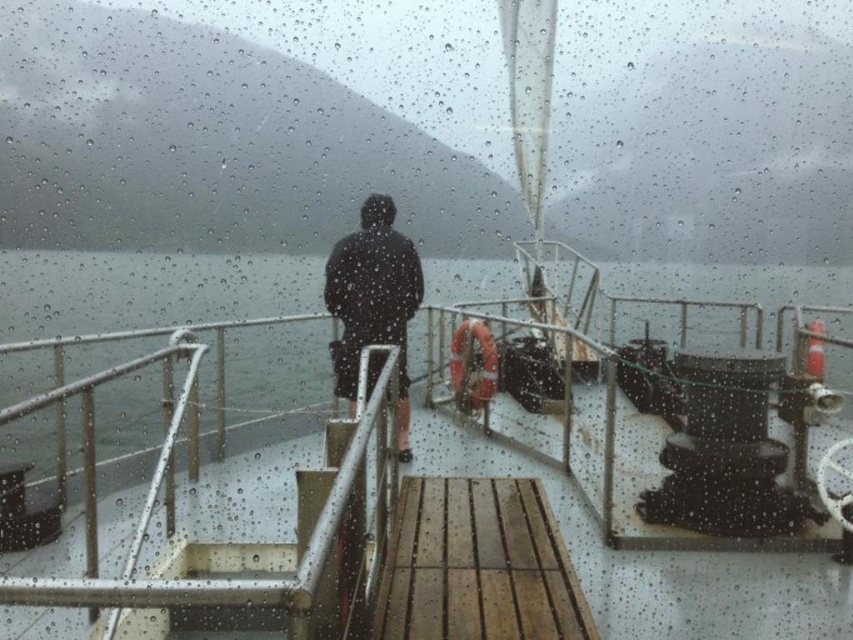
Does wooden at center come behind dark matte jacket at center?

No, wooden at center is closer to the viewer.

Is the position of wooden at center less distant than that of dark matte jacket at center?

Yes, wooden at center is in front of dark matte jacket at center.

Describe the element at coordinates (479, 564) in the screenshot. I see `wooden at center` at that location.

Locate an element on the screen. wooden at center is located at coordinates (479, 564).